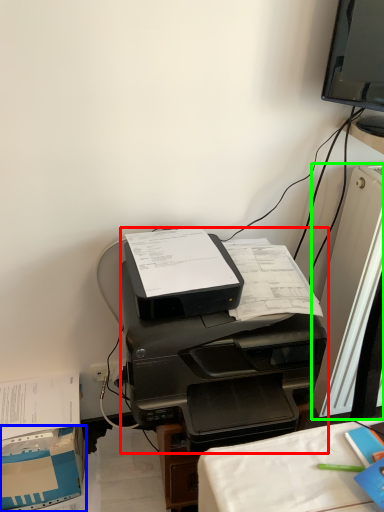
Question: Which is farther away from printer (highlighted by a red box)? cardboard box (highlighted by a blue box) or desktop computer (highlighted by a green box)?

Choices:
 (A) cardboard box
 (B) desktop computer

Answer: (A)